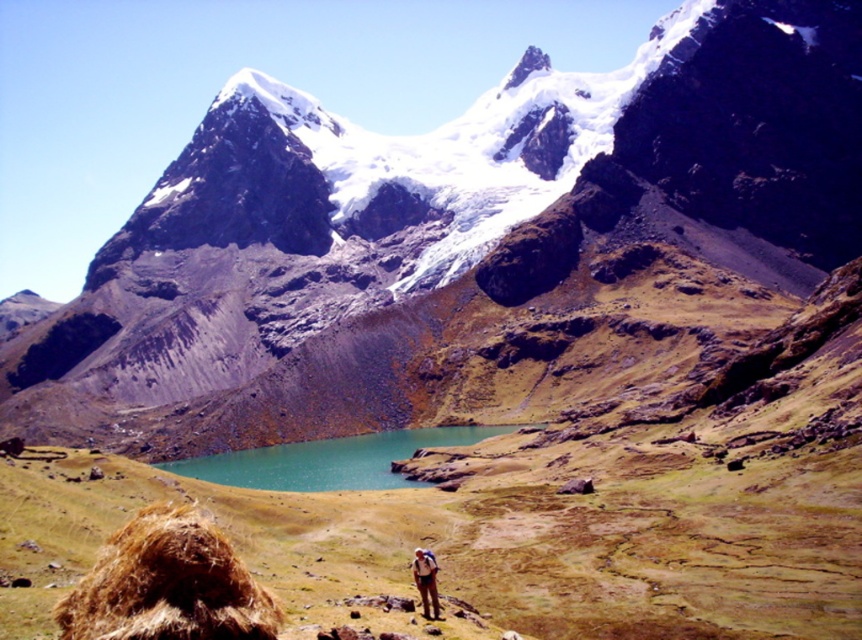
Question: Does rocky mountain range at center appear over brown fluffy hay at lower left?

Choices:
 (A) yes
 (B) no

Answer: (A)

Question: Which object appears closest to the camera in this image?

Choices:
 (A) rocky mountain range at center
 (B) brown fluffy hay at lower left
 (C) brown fabric pants at lower center
 (D) teal glassy water at center

Answer: (B)

Question: Does rocky mountain range at center appear on the left side of brown fluffy hay at lower left?

Choices:
 (A) no
 (B) yes

Answer: (A)

Question: Estimate the real-world distances between objects in this image. Which object is closer to the brown fluffy hay at lower left?

Choices:
 (A) teal glassy water at center
 (B) brown fabric pants at lower center
 (C) rocky mountain range at center

Answer: (B)

Question: Which of the following is the farthest from the observer?

Choices:
 (A) (757, 49)
 (B) (175, 611)
 (C) (361, 440)

Answer: (A)

Question: Can you confirm if rocky mountain range at center is wider than brown fabric pants at lower center?

Choices:
 (A) yes
 (B) no

Answer: (A)